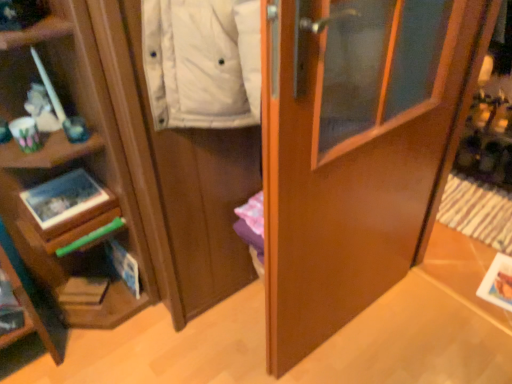
Find the location of a particular element. Image resolution: width=512 pixels, height=384 pixels. vacant area situated to the left side of glossy wood door at center is located at coordinates pyautogui.click(x=214, y=338).